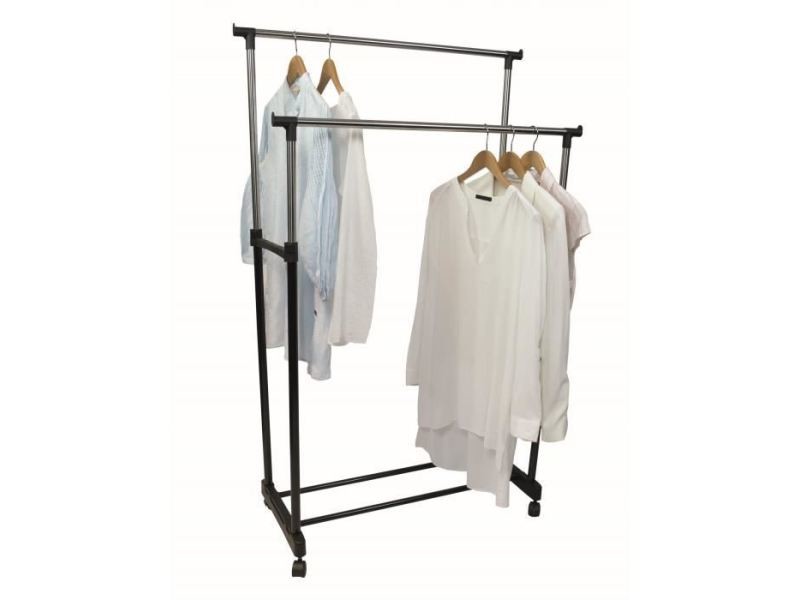
Where is `clothes hangers`? Image resolution: width=800 pixels, height=600 pixels. clothes hangers is located at coordinates (294, 66), (330, 70), (485, 162), (513, 166), (536, 166).